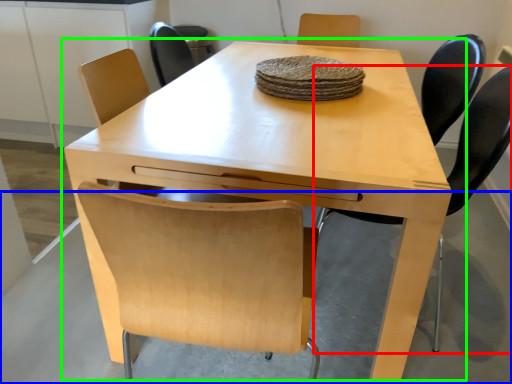
Question: Which object is the closest to the chair (highlighted by a red box)? Choose among these: concrete (highlighted by a blue box) or table (highlighted by a green box).

Choices:
 (A) concrete
 (B) table

Answer: (B)